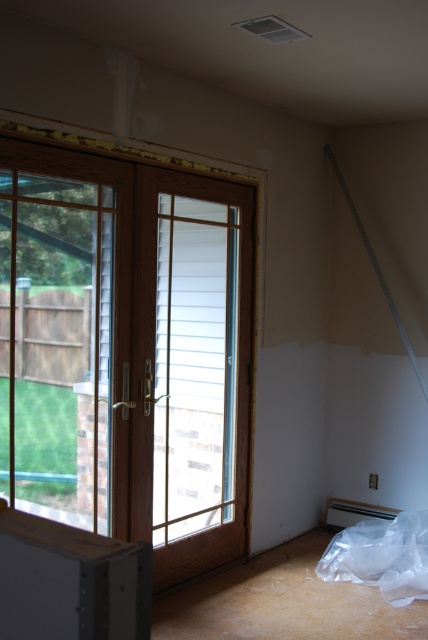
Question: Which of the following is the farthest from the observer?

Choices:
 (A) (231, 404)
 (B) (154, 547)

Answer: (A)

Question: Which point appears farthest from the camera in this image?

Choices:
 (A) (44, 192)
 (B) (199, 301)

Answer: (B)

Question: Is clear glass door at left to the left of brown wooden screen door at center from the viewer's perspective?

Choices:
 (A) no
 (B) yes

Answer: (B)

Question: Which point is closer to the camera?

Choices:
 (A) (237, 470)
 (B) (210, 289)

Answer: (A)

Question: Does clear glass door at left appear over brown wooden screen door at center?

Choices:
 (A) yes
 (B) no

Answer: (A)

Question: Does clear glass door at left appear over brown wooden screen door at center?

Choices:
 (A) no
 (B) yes

Answer: (B)